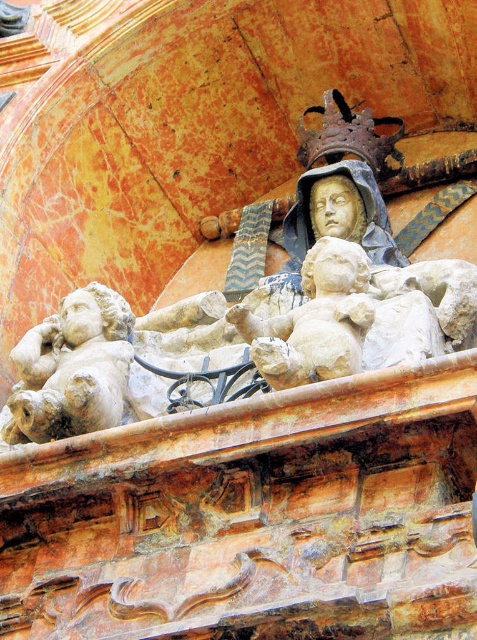
Question: Considering the relative positions of white marble cherub at lower left and stone cherub at center in the image provided, where is white marble cherub at lower left located with respect to stone cherub at center?

Choices:
 (A) above
 (B) below

Answer: (B)

Question: Is white marble cherub at lower left to the right of stone cherub at center from the viewer's perspective?

Choices:
 (A) yes
 (B) no

Answer: (B)

Question: Which point is closer to the camera?

Choices:
 (A) (89, 429)
 (B) (318, 280)

Answer: (A)

Question: Which point is farther to the camera?

Choices:
 (A) (302, 384)
 (B) (100, 388)

Answer: (B)

Question: From the image, what is the correct spatial relationship of white marble cherub at lower left in relation to stone cherub at center?

Choices:
 (A) below
 (B) above

Answer: (A)

Question: Which point is farther from the camera taking this photo?

Choices:
 (A) (58, 348)
 (B) (350, 275)

Answer: (A)